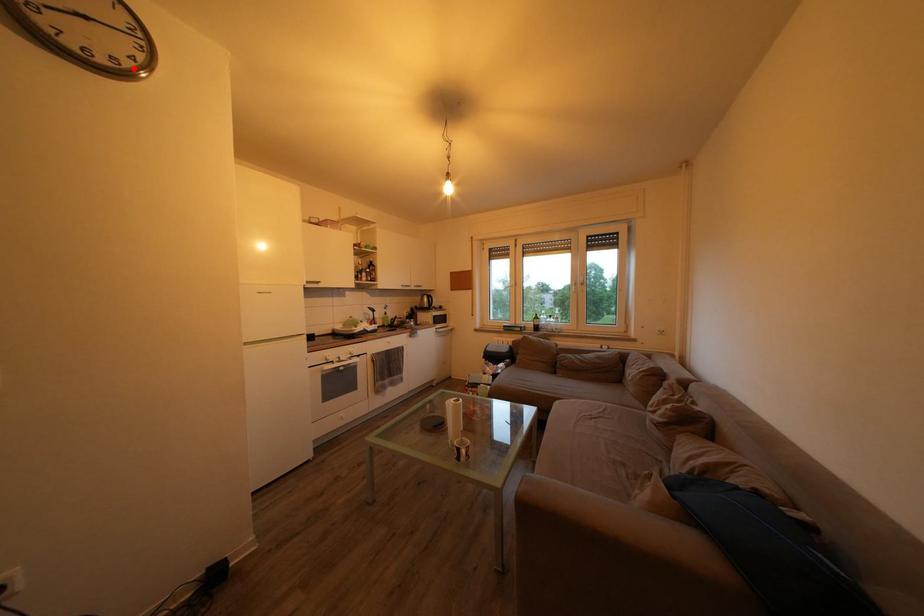
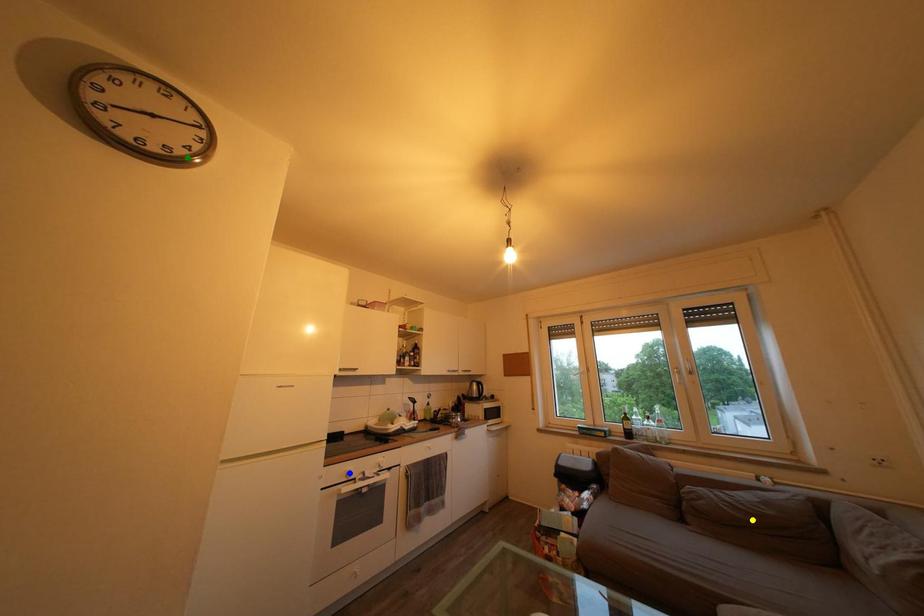
Question: I am providing you with two images of the same scene from different viewpoints. A red point is marked on the first image. You are given multiple points on the second image. Which point in image 2 represents the same 3d spot as the red point in image 1?

Choices:
 (A) green point
 (B) blue point
 (C) yellow point

Answer: (A)